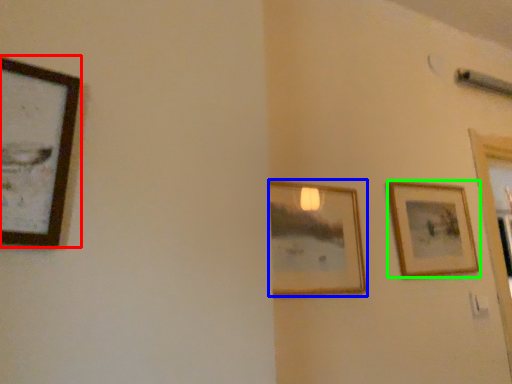
Question: Which is farther away from picture frame (highlighted by a red box)? picture frame (highlighted by a blue box) or picture frame (highlighted by a green box)?

Choices:
 (A) picture frame
 (B) picture frame

Answer: (B)